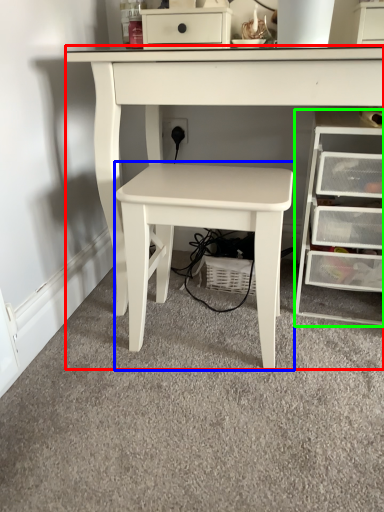
Question: Which is nearer to the table (highlighted by a red box)? table (highlighted by a blue box) or chest of drawers (highlighted by a green box).

Choices:
 (A) table
 (B) chest of drawers

Answer: (A)